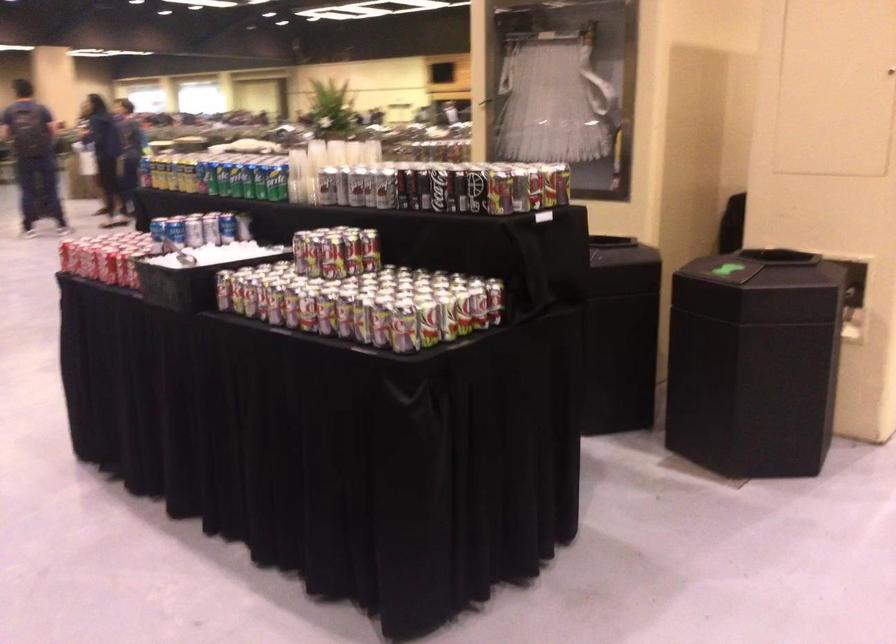
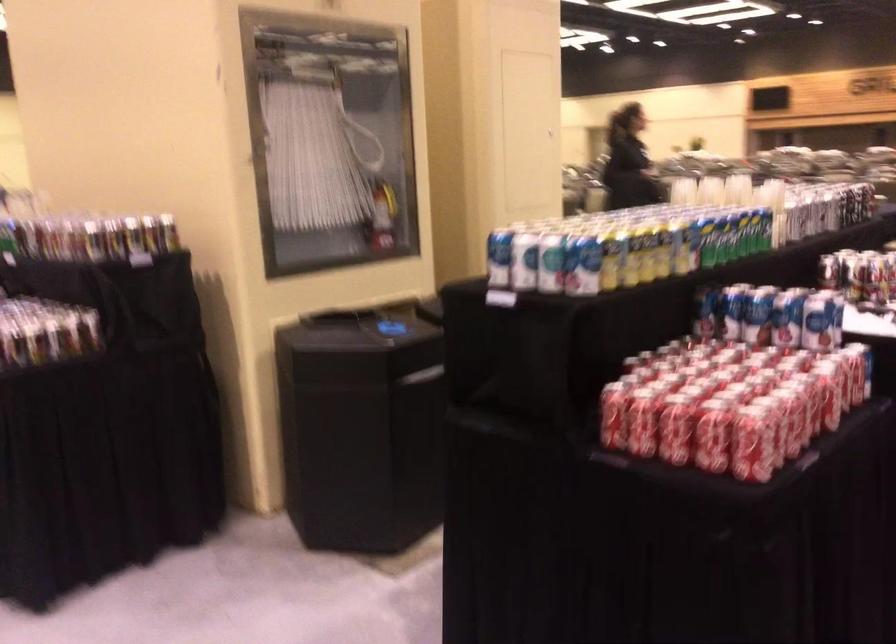
Where in the second image is the point corresponding to pixel 220 220 from the first image?

(703, 312)